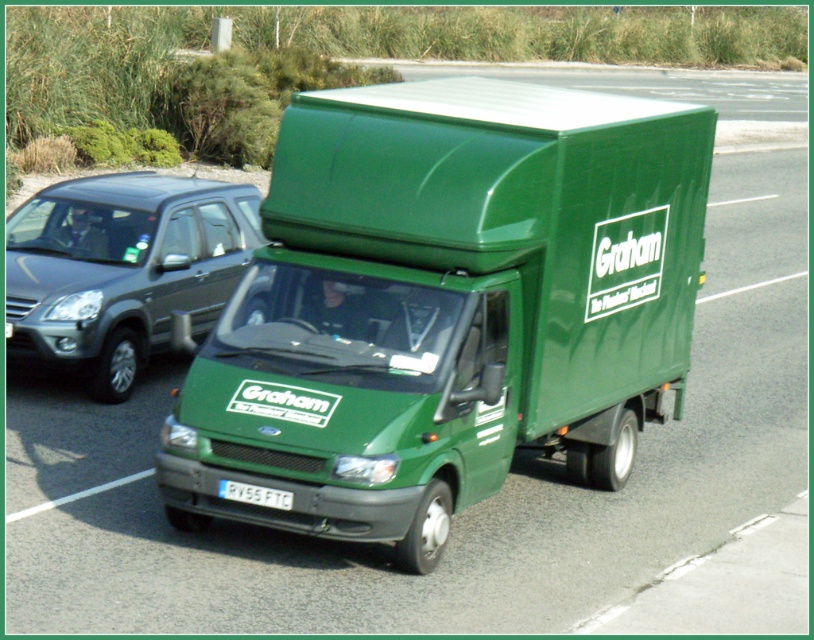
Between metallic gray suv at left and white plastic license plate at center, which one has more height?

With more height is metallic gray suv at left.

Does metallic gray suv at left appear on the left side of white plastic license plate at center?

Yes, metallic gray suv at left is to the left of white plastic license plate at center.

Is point (224, 186) closer to viewer compared to point (241, 500)?

That is False.

Find the location of `metallic gray suv at left`. metallic gray suv at left is located at coordinates (121, 268).

Which is more to the left, green matte truck at center or white plastic license plate at center?

From the viewer's perspective, white plastic license plate at center appears more on the left side.

Does green matte truck at center appear on the left side of white plastic license plate at center?

In fact, green matte truck at center is to the right of white plastic license plate at center.

Which is in front, point (322, 250) or point (263, 492)?

Positioned in front is point (263, 492).

The image size is (814, 640). What are the coordinates of `green matte truck at center` in the screenshot? It's located at (445, 307).

Is green matte truck at center smaller than metallic gray suv at left?

Incorrect, green matte truck at center is not smaller in size than metallic gray suv at left.

Is green matte truck at center positioned behind metallic gray suv at left?

No.

The height and width of the screenshot is (640, 814). In order to click on green matte truck at center in this screenshot , I will do `click(445, 307)`.

Locate an element on the screen. The height and width of the screenshot is (640, 814). green matte truck at center is located at coordinates (445, 307).